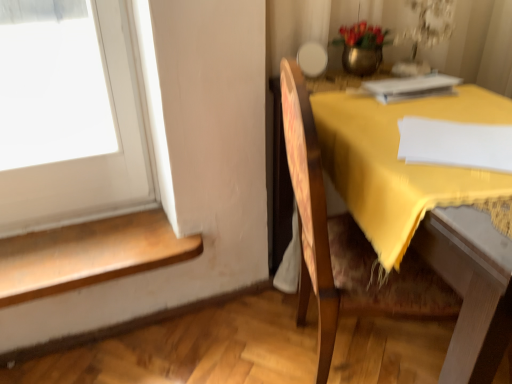
Question: From a real-world perspective, is metallic vase at upper center on top of wooden chair at right?

Choices:
 (A) yes
 (B) no

Answer: (A)

Question: Does metallic vase at upper center have a greater height compared to wooden chair at right?

Choices:
 (A) no
 (B) yes

Answer: (A)

Question: Is metallic vase at upper center at the left side of wooden chair at right?

Choices:
 (A) yes
 (B) no

Answer: (A)

Question: Considering the relative sizes of metallic vase at upper center and wooden chair at right in the image provided, is metallic vase at upper center smaller than wooden chair at right?

Choices:
 (A) no
 (B) yes

Answer: (B)

Question: Considering the relative sizes of metallic vase at upper center and wooden chair at right in the image provided, is metallic vase at upper center wider than wooden chair at right?

Choices:
 (A) yes
 (B) no

Answer: (B)

Question: From the image's perspective, is white paper at upper right located above or below wooden chair at right?

Choices:
 (A) below
 (B) above

Answer: (B)

Question: In terms of width, does white paper at upper right look wider or thinner when compared to wooden chair at right?

Choices:
 (A) thin
 (B) wide

Answer: (A)

Question: Relative to wooden chair at right, is white paper at upper right in front or behind?

Choices:
 (A) behind
 (B) front

Answer: (A)

Question: Is white paper at upper right bigger or smaller than wooden chair at right?

Choices:
 (A) small
 (B) big

Answer: (A)

Question: In the image, is wooden step at lower left positioned in front of or behind wooden chair at right?

Choices:
 (A) behind
 (B) front

Answer: (A)

Question: From the image's perspective, is wooden step at lower left located above or below wooden chair at right?

Choices:
 (A) above
 (B) below

Answer: (B)

Question: In terms of size, does wooden step at lower left appear bigger or smaller than wooden chair at right?

Choices:
 (A) big
 (B) small

Answer: (B)

Question: From their relative heights in the image, would you say wooden step at lower left is taller or shorter than wooden chair at right?

Choices:
 (A) tall
 (B) short

Answer: (B)

Question: Is point (175, 248) positioned closer to the camera than point (381, 96)?

Choices:
 (A) closer
 (B) farther

Answer: (B)

Question: From the image's perspective, is wooden step at lower left above or below white paper at upper right?

Choices:
 (A) below
 (B) above

Answer: (A)